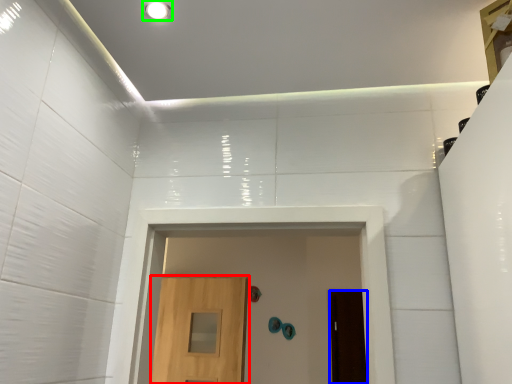
Question: Which object is positioned farthest from door (highlighted by a red box)? Select from door (highlighted by a blue box) and lighting (highlighted by a green box).

Choices:
 (A) door
 (B) lighting

Answer: (B)